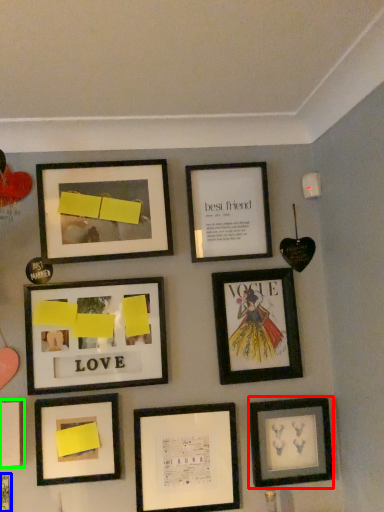
Question: Which object is positioned closest to picture frame (highlighted by a red box)? Select from picture frame (highlighted by a blue box) and picture frame (highlighted by a green box).

Choices:
 (A) picture frame
 (B) picture frame

Answer: (B)